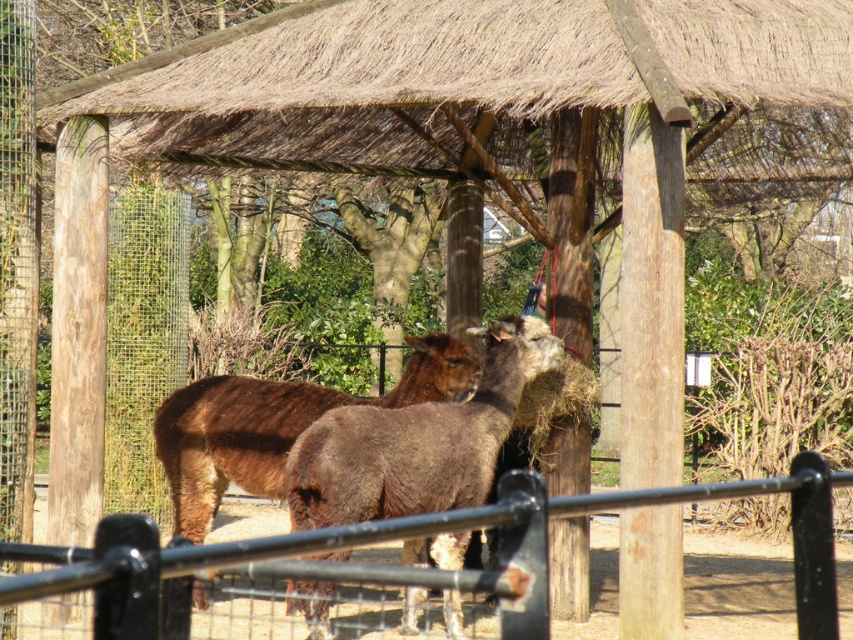
Is black metal fence at lower center above brown fuzzy alpaca at center?

Actually, black metal fence at lower center is below brown fuzzy alpaca at center.

Is the position of black metal fence at lower center less distant than that of brown fuzzy alpaca at center?

Yes, black metal fence at lower center is closer to the viewer.

What are the coordinates of `black metal fence at lower center` in the screenshot? It's located at (386, 564).

Is black metal fence at lower center to the left of brown woolly alpaca at center from the viewer's perspective?

Incorrect, black metal fence at lower center is not on the left side of brown woolly alpaca at center.

Is point (10, 552) farther from viewer compared to point (438, 372)?

No, (10, 552) is closer to viewer.

Where is `black metal fence at lower center`? The height and width of the screenshot is (640, 853). black metal fence at lower center is located at coordinates (386, 564).

Can you confirm if brown fuzzy alpaca at center is bigger than brown woolly alpaca at center?

Indeed, brown fuzzy alpaca at center has a larger size compared to brown woolly alpaca at center.

From the picture: How far apart are brown fuzzy alpaca at center and brown woolly alpaca at center?

brown fuzzy alpaca at center and brown woolly alpaca at center are 97.19 centimeters apart from each other.

Find the location of a particular element. Image resolution: width=853 pixels, height=640 pixels. brown fuzzy alpaca at center is located at coordinates (416, 440).